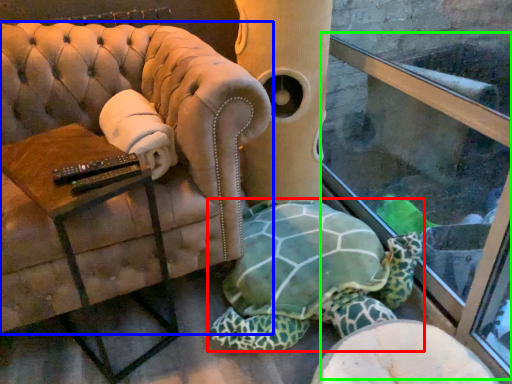
Question: Considering the real-world distances, which object is farthest from tortoise (highlighted by a red box)? chair (highlighted by a blue box) or shop window (highlighted by a green box)?

Choices:
 (A) chair
 (B) shop window

Answer: (A)